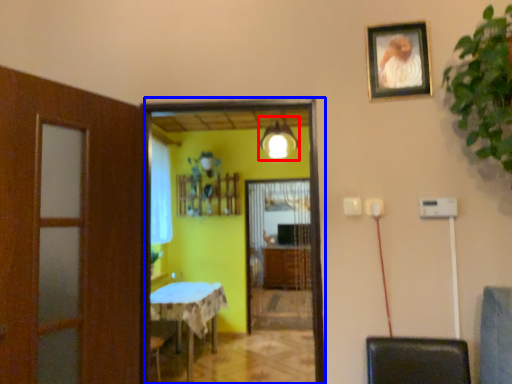
Question: Which point is closer to the camera, light fixture (highlighted by a red box) or screen door (highlighted by a blue box)?

Choices:
 (A) light fixture
 (B) screen door

Answer: (B)